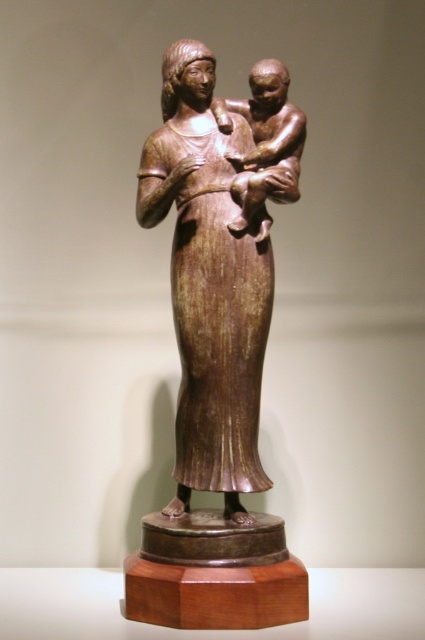
You are an art conservator assessing the stability of the sculpture. Given that the bronze statue at center and bronze baby at center are both mounted on a hexagonal base, which object has a greater width that could affect the center of gravity?

The bronze statue at center is wider than the bronze baby at center, so it contributes more to the overall width and thus affects the center of gravity more significantly.

You are an art conservator working on a sculpture. You need to ensure that the bronze statue at center and the bronze baby at center are positioned safely. Given that the minimum safe distance between them is 6 inches to prevent accidental contact during handling, is the current distance sufficient?

The distance between the bronze statue at center and the bronze baby at center is 5.51 inches, which is less than the required 6 inches. Therefore, the current distance is not sufficient for safe handling.

You are standing in front of the bronze sculpture and want to take a photo. You notice two points on the sculpture labeled as point (190, 550) and point (249, 112). Which point should you focus on to ensure it appears closer in your photo?

Point (190, 550) is closer to the camera than point (249, 112), so focusing on point (190, 550) will make it appear closer in the photo.